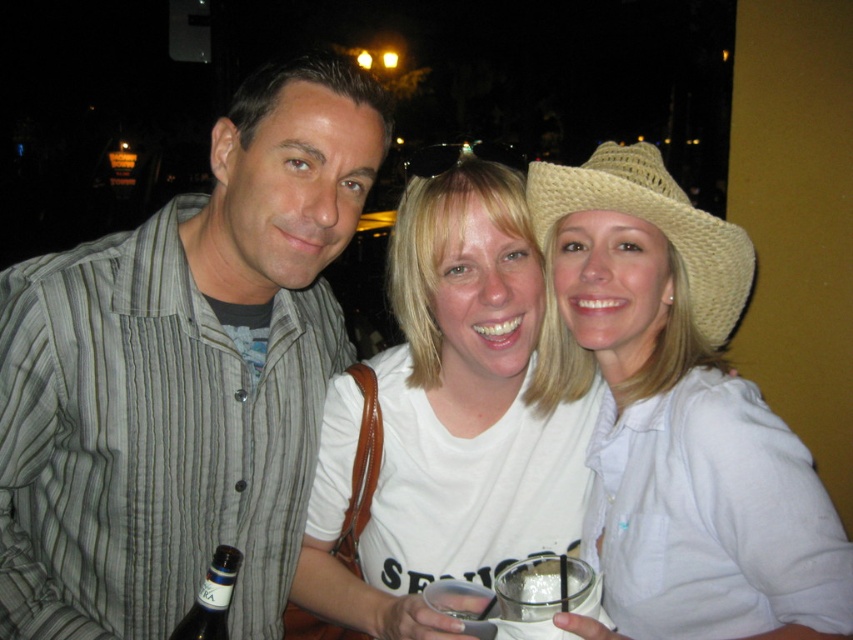
You are a GUI agent. You are given a task and a screenshot of the screen. Output one action in this format:
    pyautogui.click(x=<x>, y=<y>)
    Task: Click on the white cotton shirt at center
    The width and height of the screenshot is (853, 640).
    Given the screenshot: What is the action you would take?
    pyautogui.click(x=447, y=419)

Between white cotton shirt at center and natural straw hat at center, which one is positioned lower?

white cotton shirt at center is below.

Between point (469, 417) and point (723, 221), which one is positioned in front?

Point (723, 221) is in front.

Locate an element on the screen. Image resolution: width=853 pixels, height=640 pixels. white cotton shirt at center is located at coordinates (447, 419).

Which of these two, natural straw hat at center or dark brown glass bottle at center, stands taller?

natural straw hat at center

Does point (610, 177) lie behind point (189, 634)?

Yes.

Identify the location of natural straw hat at center. (653, 227).

Is striped cotton shirt at left shorter than white woven straw hat at upper right?

No, striped cotton shirt at left is not shorter than white woven straw hat at upper right.

Does striped cotton shirt at left have a greater width compared to white woven straw hat at upper right?

Indeed, striped cotton shirt at left has a greater width compared to white woven straw hat at upper right.

Describe the element at coordinates (183, 374) in the screenshot. This screenshot has height=640, width=853. I see `striped cotton shirt at left` at that location.

Find the location of a particular element. The width and height of the screenshot is (853, 640). striped cotton shirt at left is located at coordinates (183, 374).